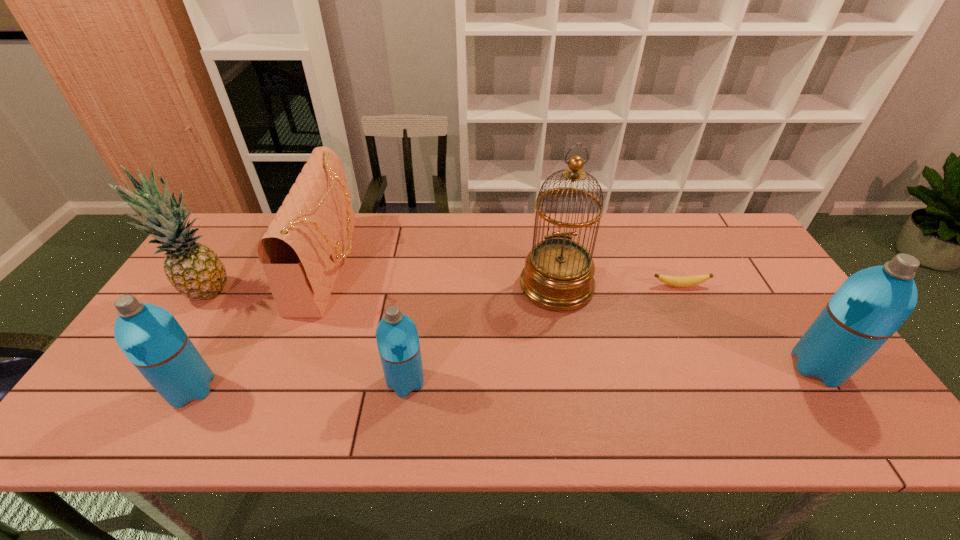
Locate an element on the screen. This screenshot has height=540, width=960. the second tallest thermos bottle is located at coordinates (151, 338).

This screenshot has width=960, height=540. Identify the location of the shortest thermos bottle. (397, 338).

Image resolution: width=960 pixels, height=540 pixels. Identify the location of the second thermos bottle from right to left. (397, 338).

Find the location of a particular element. This screenshot has width=960, height=540. the rightmost thermos bottle is located at coordinates (870, 306).

Locate an element on the screen. The height and width of the screenshot is (540, 960). handbag is located at coordinates (301, 253).

This screenshot has width=960, height=540. What are the coordinates of `birdcage` in the screenshot? It's located at (558, 275).

At what (x,y) coordinates should I click in order to perform the action: click on the shortest object. Please return your answer as a coordinate pair (x, y). Looking at the image, I should click on tap(678, 281).

Identify the location of banana. Image resolution: width=960 pixels, height=540 pixels. (678, 281).

Find the location of a particular element. This screenshot has height=540, width=960. pineapple is located at coordinates [193, 269].

Find the location of a particular element. The image size is (960, 540). vacant region located on the back of the leftmost thermos bottle is located at coordinates (214, 347).